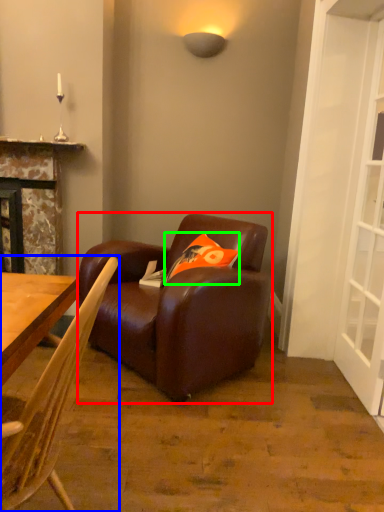
Question: Estimate the real-world distances between objects in this image. Which object is farther from studio couch (highlighted by a red box), chair (highlighted by a blue box) or pillow (highlighted by a green box)?

Choices:
 (A) chair
 (B) pillow

Answer: (A)